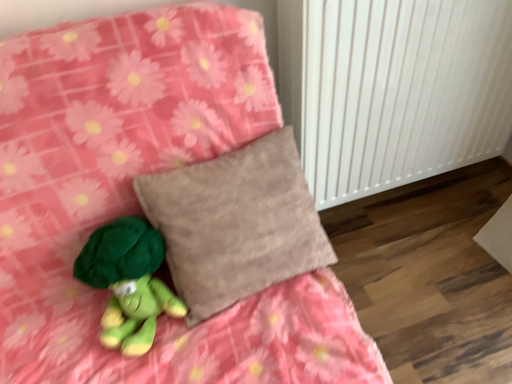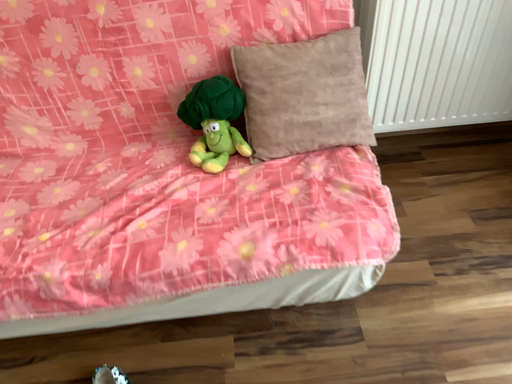
Question: Which way did the camera rotate in the video?

Choices:
 (A) rotated left
 (B) rotated right

Answer: (A)